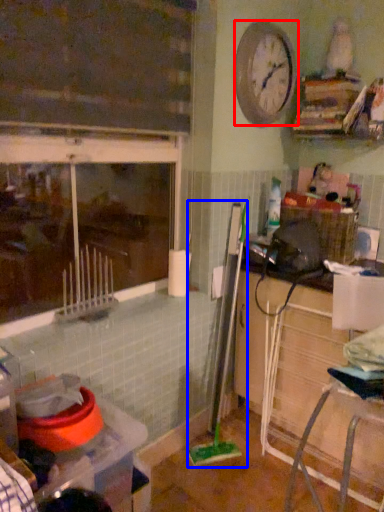
Question: Among these objects, which one is farthest to the camera, clock (highlighted by a red box) or brush (highlighted by a blue box)?

Choices:
 (A) clock
 (B) brush

Answer: (B)